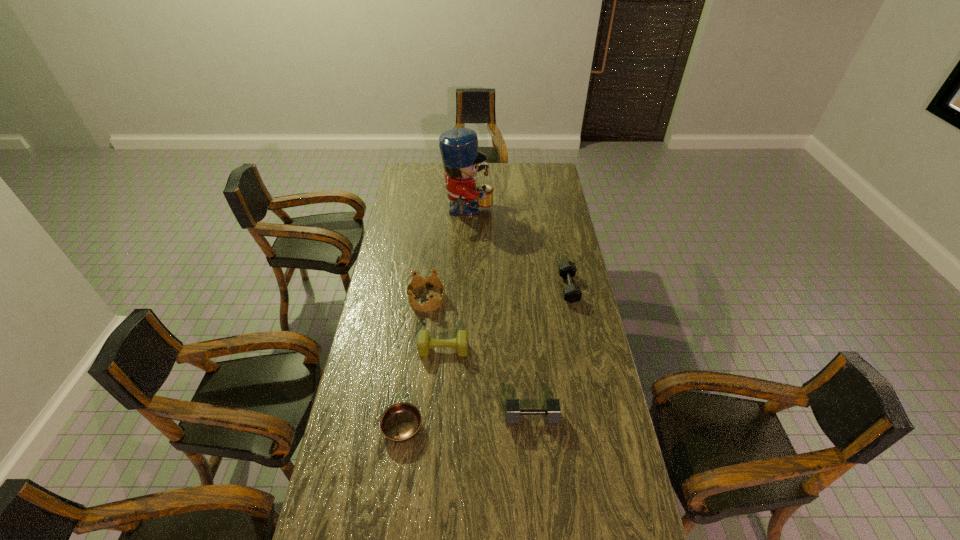
The width and height of the screenshot is (960, 540). In order to click on the tallest object in this screenshot , I will do `click(461, 158)`.

I want to click on nutcracker, so click(x=461, y=158).

This screenshot has width=960, height=540. What are the coordinates of `the fifth shortest object` in the screenshot? It's located at (433, 303).

This screenshot has width=960, height=540. In order to click on the rightmost dumbbell in this screenshot , I will do `click(572, 293)`.

Where is `the rightmost object`? Image resolution: width=960 pixels, height=540 pixels. the rightmost object is located at coordinates (572, 293).

Where is `the nearest dumbbell`? Image resolution: width=960 pixels, height=540 pixels. the nearest dumbbell is located at coordinates (552, 411).

In order to click on the second dumbbell from right to left in this screenshot , I will do `click(552, 411)`.

I want to click on the leftmost dumbbell, so click(425, 343).

This screenshot has height=540, width=960. I want to click on the third nearest object, so click(425, 343).

Where is `soup bowl`? soup bowl is located at coordinates (400, 422).